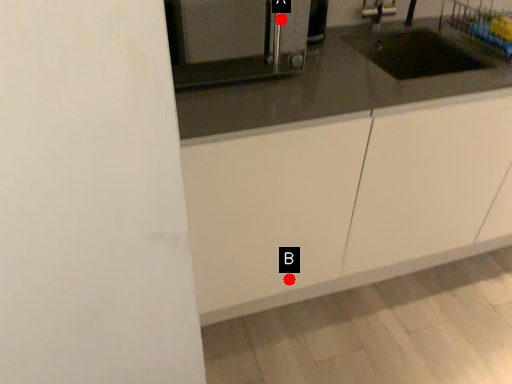
Question: Two points are circled on the image, labeled by A and B beside each circle. Which point is closer to the camera?

Choices:
 (A) A is closer
 (B) B is closer

Answer: (A)